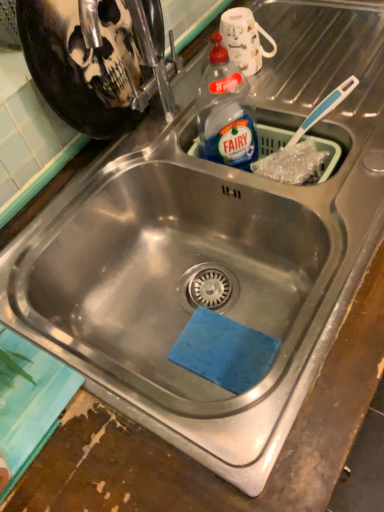
The width and height of the screenshot is (384, 512). I want to click on white glossy mug at upper center, so click(x=244, y=40).

What do you see at coordinates (244, 40) in the screenshot? I see `white glossy mug at upper center` at bounding box center [244, 40].

What do you see at coordinates (226, 112) in the screenshot? The width and height of the screenshot is (384, 512). I see `transparent plastic bottle at upper right` at bounding box center [226, 112].

At what (x,y) coordinates should I click in order to perform the action: click on transparent plastic bottle at upper right. Please return your answer as a coordinate pair (x, y). Image resolution: width=384 pixels, height=512 pixels. Looking at the image, I should click on (226, 112).

What are the coordinates of `white glossy mug at upper center` in the screenshot? It's located at (244, 40).

Considering the relative positions of white glossy mug at upper center and transparent plastic bottle at upper right in the image provided, is white glossy mug at upper center to the left or to the right of transparent plastic bottle at upper right?

In the image, white glossy mug at upper center appears on the right side of transparent plastic bottle at upper right.

Which is behind, white glossy mug at upper center or transparent plastic bottle at upper right?

white glossy mug at upper center is further away from the camera.

Which point is more forward, (x=242, y=42) or (x=208, y=152)?

Point (x=208, y=152)

From the image's perspective, is white glossy mug at upper center below transparent plastic bottle at upper right?

Incorrect, from the image's perspective, white glossy mug at upper center is higher than transparent plastic bottle at upper right.

From a real-world perspective, which is physically above, white glossy mug at upper center or transparent plastic bottle at upper right?

white glossy mug at upper center, from a real-world perspective.

Which of these two, white glossy mug at upper center or transparent plastic bottle at upper right, is wider?

white glossy mug at upper center is wider.

Considering the relative sizes of white glossy mug at upper center and transparent plastic bottle at upper right in the image provided, is white glossy mug at upper center taller than transparent plastic bottle at upper right?

In fact, white glossy mug at upper center may be shorter than transparent plastic bottle at upper right.

Can you confirm if white glossy mug at upper center is bigger than transparent plastic bottle at upper right?

Actually, white glossy mug at upper center might be smaller than transparent plastic bottle at upper right.

Looking at this image, would you say white glossy mug at upper center contains transparent plastic bottle at upper right?

No, white glossy mug at upper center does not contain transparent plastic bottle at upper right.

Can you see white glossy mug at upper center touching transparent plastic bottle at upper right?

→ Yes, white glossy mug at upper center is touching transparent plastic bottle at upper right.

Is white glossy mug at upper center positioned with its back to transparent plastic bottle at upper right?

No, transparent plastic bottle at upper right is not at the back of white glossy mug at upper center.

How many degrees apart are the facing directions of white glossy mug at upper center and transparent plastic bottle at upper right?

35.2 degrees separate the facing orientations of white glossy mug at upper center and transparent plastic bottle at upper right.

Where is `bottle in front of the white glossy mug at upper center`? This screenshot has height=512, width=384. bottle in front of the white glossy mug at upper center is located at coordinates (226, 112).

Considering the relative positions of transparent plastic bottle at upper right and white glossy mug at upper center in the image provided, is transparent plastic bottle at upper right to the left of white glossy mug at upper center from the viewer's perspective?

Yes, transparent plastic bottle at upper right is to the left of white glossy mug at upper center.

Considering the positions of objects transparent plastic bottle at upper right and white glossy mug at upper center in the image provided, who is in front, transparent plastic bottle at upper right or white glossy mug at upper center?

transparent plastic bottle at upper right is closer to the camera.

Which is further, (230, 81) or (245, 55)?

The point (245, 55) is farther.

From the image's perspective, which is above, transparent plastic bottle at upper right or white glossy mug at upper center?

From the image's view, white glossy mug at upper center is above.

From a real-world perspective, relative to white glossy mug at upper center, is transparent plastic bottle at upper right vertically above or below?

In terms of real-world spatial position, transparent plastic bottle at upper right is below white glossy mug at upper center.

From the picture: Does transparent plastic bottle at upper right have a lesser width compared to white glossy mug at upper center?

Yes.

Who is taller, transparent plastic bottle at upper right or white glossy mug at upper center?

With more height is transparent plastic bottle at upper right.

Looking at the image, does transparent plastic bottle at upper right seem bigger or smaller compared to white glossy mug at upper center?

Clearly, transparent plastic bottle at upper right is larger in size than white glossy mug at upper center.

Would you say white glossy mug at upper center is part of transparent plastic bottle at upper right's contents?

That's incorrect, white glossy mug at upper center is not inside transparent plastic bottle at upper right.

Is transparent plastic bottle at upper right next to white glossy mug at upper center?

Absolutely, transparent plastic bottle at upper right is next to and touching white glossy mug at upper center.

Looking at this image, is transparent plastic bottle at upper right aimed at white glossy mug at upper center?

No, transparent plastic bottle at upper right is not oriented towards white glossy mug at upper center.

This screenshot has height=512, width=384. What are the coordinates of `mug located on the right of transparent plastic bottle at upper right` in the screenshot? It's located at (244, 40).

In the image, there is a white glossy mug at upper center. Identify the location of bottle below it (from a real-world perspective). The height and width of the screenshot is (512, 384). (226, 112).

At what (x,y) coordinates should I click in order to perform the action: click on mug located above the transparent plastic bottle at upper right (from a real-world perspective). Please return your answer as a coordinate pair (x, y). This screenshot has width=384, height=512. Looking at the image, I should click on (244, 40).